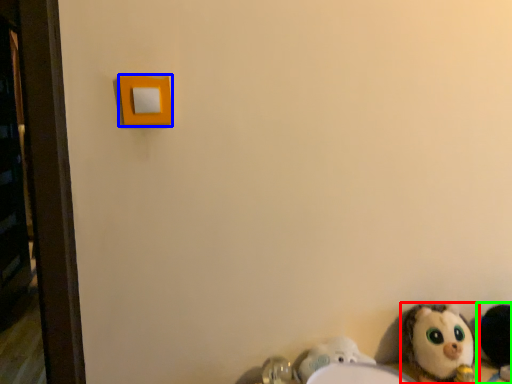
Question: Estimate the real-world distances between objects in this image. Which object is farther from toy (highlighted by a red box), light switch (highlighted by a blue box) or toy (highlighted by a green box)?

Choices:
 (A) light switch
 (B) toy

Answer: (A)